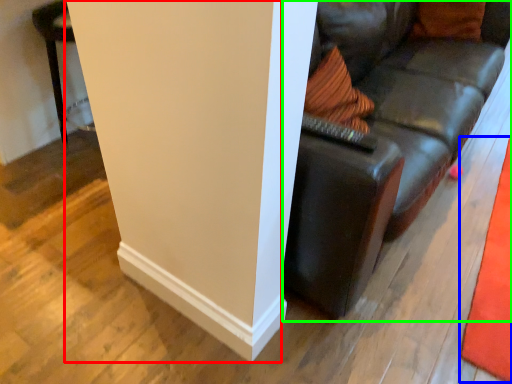
Question: Considering the real-world distances, which object is closest to pillar (highlighted by a red box)? mat (highlighted by a blue box) or studio couch (highlighted by a green box).

Choices:
 (A) mat
 (B) studio couch

Answer: (B)